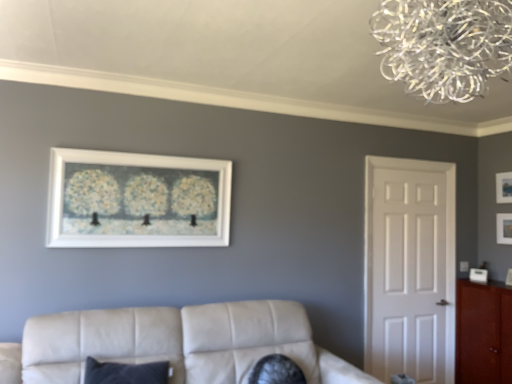
Question: From the image's perspective, is matte black picture frame at upper right, which ranks as the third picture frame in left-to-right order, above or below white matte door at right?

Choices:
 (A) below
 (B) above

Answer: (B)

Question: From a real-world perspective, is matte black picture frame at upper right, which ranks as the third picture frame in left-to-right order, positioned above or below white matte door at right?

Choices:
 (A) below
 (B) above

Answer: (B)

Question: Which of these objects is positioned farthest from the leather couch at lower center?

Choices:
 (A) matte white picture frame at upper right, marked as the second picture frame in a back-to-front arrangement
 (B) clear glass chandelier at upper right
 (C) white matte picture frame at upper center, the 1th picture frame from the left
 (D) white matte door at right
 (E) mahogany wood cabinet at right

Answer: (A)

Question: Estimate the real-world distances between objects in this image. Which object is farther from the clear glass chandelier at upper right?

Choices:
 (A) leather couch at lower center
 (B) matte black picture frame at upper right, the 1th picture frame viewed from the right
 (C) mahogany wood cabinet at right
 (D) white matte door at right
 (E) matte white picture frame at upper right, the 2th picture frame from the right

Answer: (E)